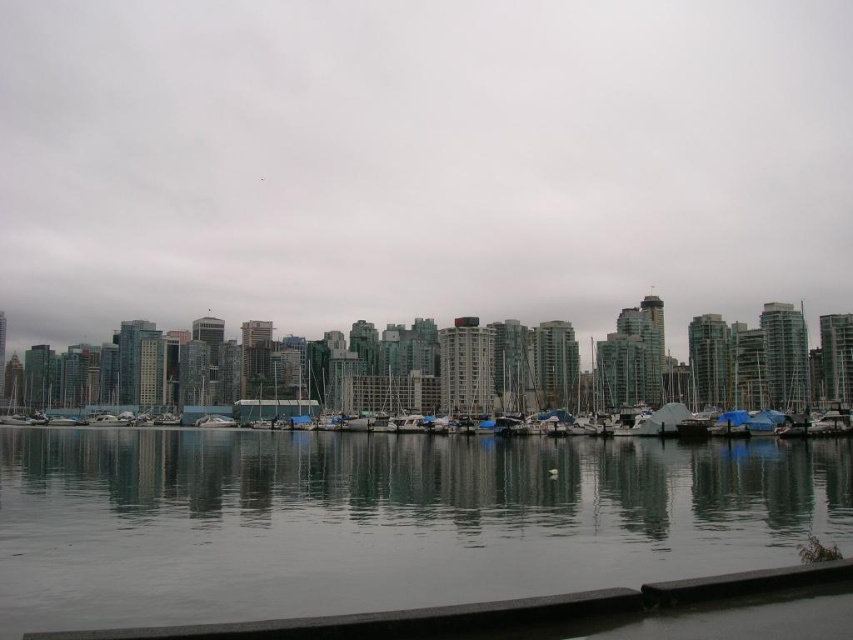
You are a drone operator trying to navigate a delivery drone through the transparent glass skyscrapers at center. The drone has a GPS marker at point [421,163]. Is this point located on the transparent glass skyscrapers at center?

Yes, the point [421,163] is on the transparent glass skyscrapers at center, so the drone can navigate to that location.

You are standing at the waterfront and want to locate two specific points in the image. The first point is at coordinates point [590,474] and the second is at point [210,419]. Which of these points is closer to your current position?

Point [590,474] is in front of point [210,419], so it is closer to your current position.

You are standing on the dock and see the smooth gray water at center and the white glossy boat at center. Which object is positioned to the right of the other?

The smooth gray water at center is to the right of the white glossy boat at center.